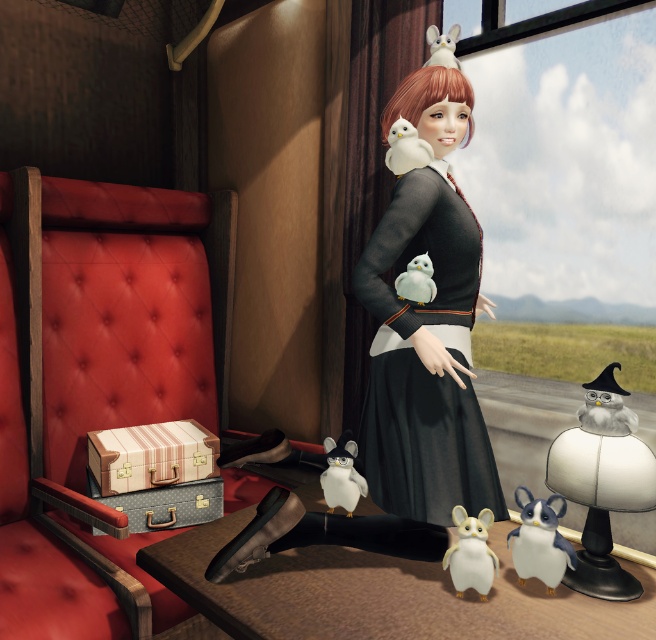
Identify the location of black matte dress at center. (424, 442).

Consider the image. Is black matte dress at center shorter than white plush bird at upper center?

In fact, black matte dress at center may be taller than white plush bird at upper center.

This screenshot has width=656, height=640. I want to click on black matte dress at center, so click(x=424, y=442).

Locate an element on the screen. The height and width of the screenshot is (640, 656). black matte dress at center is located at coordinates (424, 442).

Which is above, white plush penguin at center or white matte plush toy at center?

Positioned higher is white matte plush toy at center.

Is white plush penguin at center to the left of white matte plush toy at center from the viewer's perspective?

Yes, white plush penguin at center is to the left of white matte plush toy at center.

Is point (344, 465) in front of point (417, 260)?

No, it is not.

In order to click on white plush penguin at center in this screenshot , I will do `click(340, 474)`.

Is plush gray owl at center smaller than white matte plush toy at center?

No, plush gray owl at center is not smaller than white matte plush toy at center.

Can you confirm if plush gray owl at center is thinner than white matte plush toy at center?

No.

Find the location of a particular element. Image resolution: width=656 pixels, height=640 pixels. plush gray owl at center is located at coordinates (605, 406).